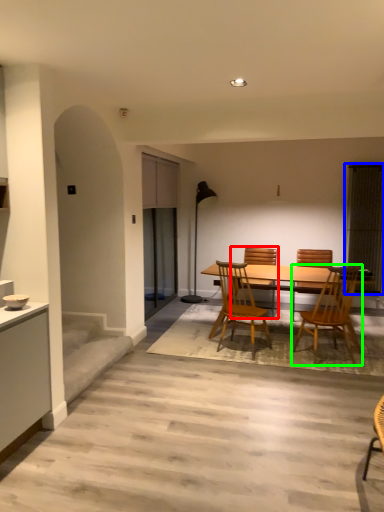
Question: Which object is positioned farthest from chair (highlighted by a red box)? Select from window screen (highlighted by a blue box) and chair (highlighted by a green box).

Choices:
 (A) window screen
 (B) chair

Answer: (B)